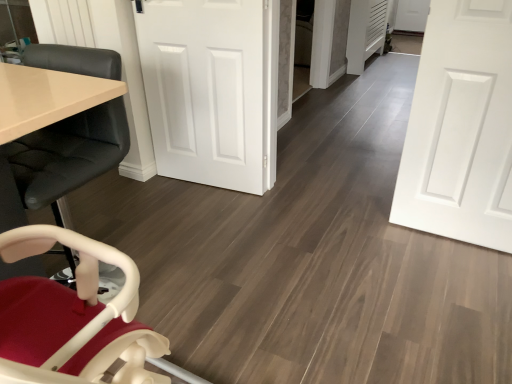
Identify the location of empty space that is in between white smooth door at center, acting as the first door starting from the left, and matte black chair at left. This screenshot has width=512, height=384. (174, 221).